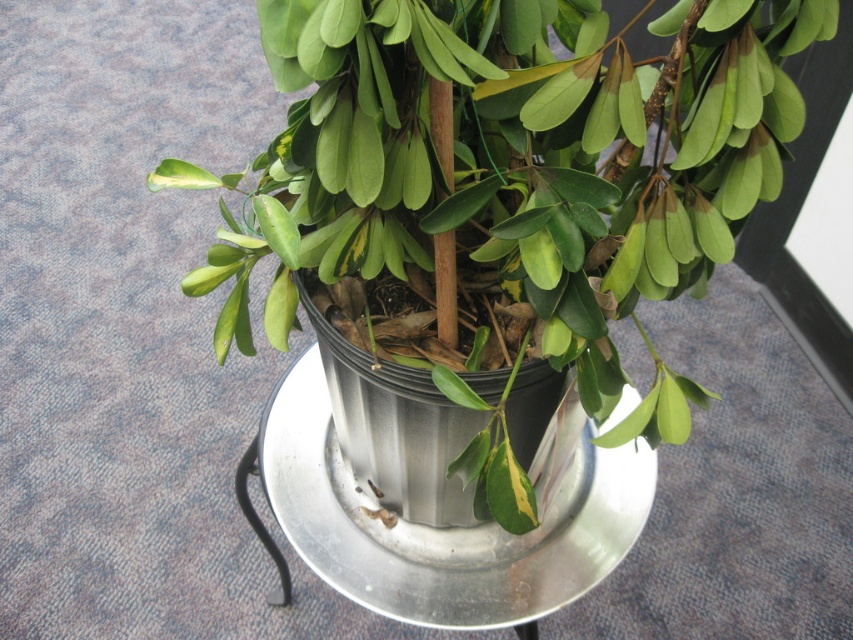
You are trying to water the green matte plant at center and the green matte leaf at center. Which one should you water first if you want to avoid getting water on the leaf?

The green matte plant at center is in front of the green matte leaf at center, so you should water the green matte plant at center first to avoid splashing water onto the leaf behind it.